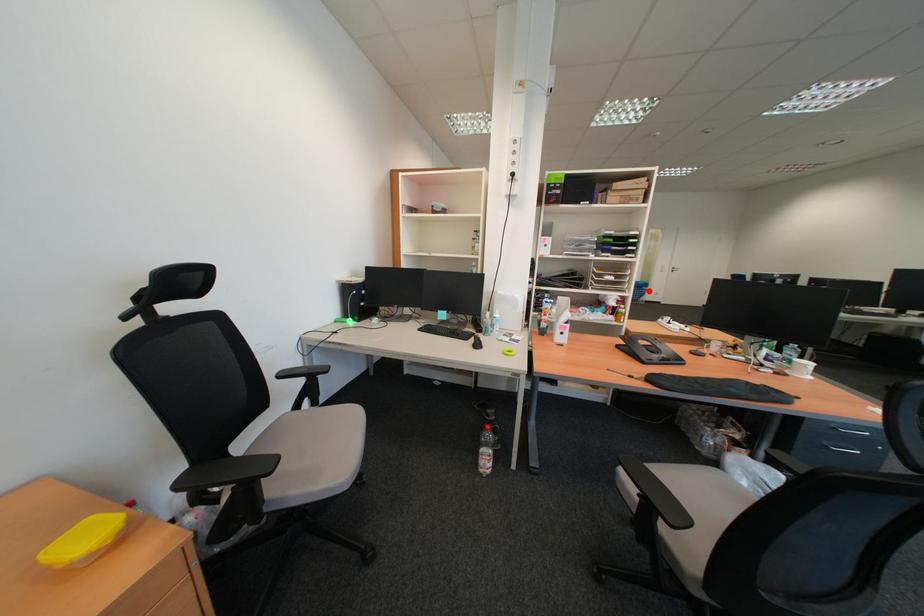
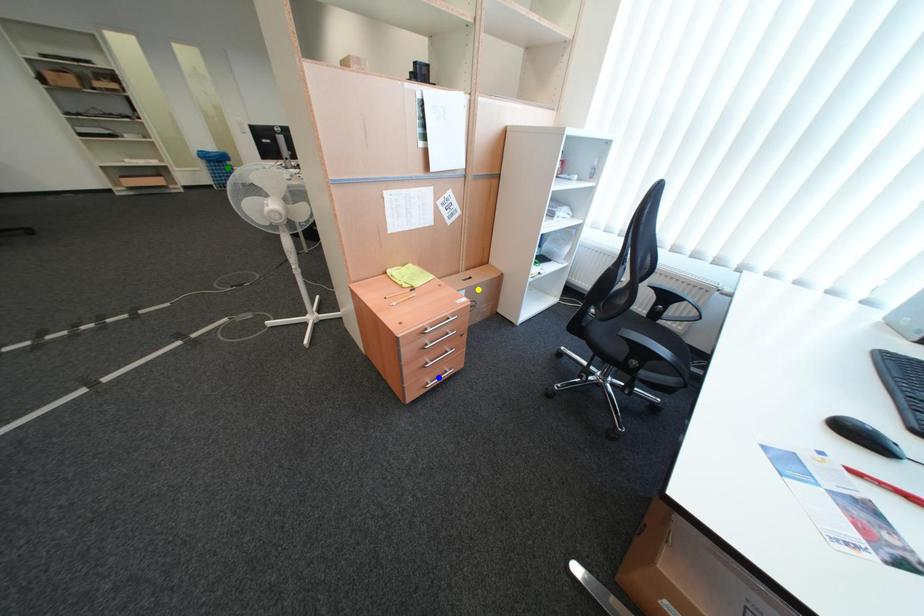
Question: I am providing you with two images of the same scene from different viewpoints. A red point is marked on the first image. You are given multiple points on the second image. Can you choose the point in image 2 that corresponds to the point in image 1?

Choices:
 (A) yellow point
 (B) green point
 (C) blue point

Answer: (B)